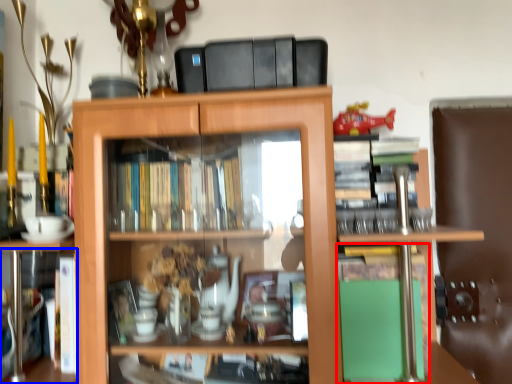
Question: Which object is closer to the camera taking this photo, book (highlighted by a red box) or book (highlighted by a blue box)?

Choices:
 (A) book
 (B) book

Answer: (B)